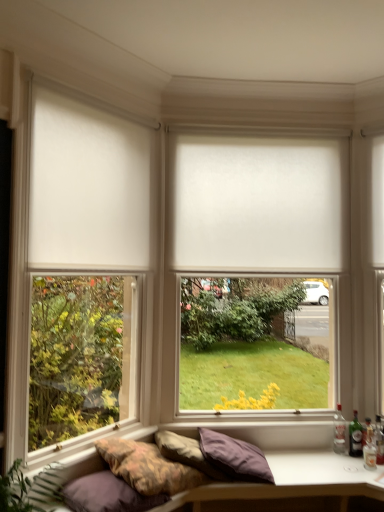
In order to click on vacant space situated on the left part of green glass bottle at lower right, which appears as the 2th bottle when viewed from the left in this screenshot , I will do `click(329, 457)`.